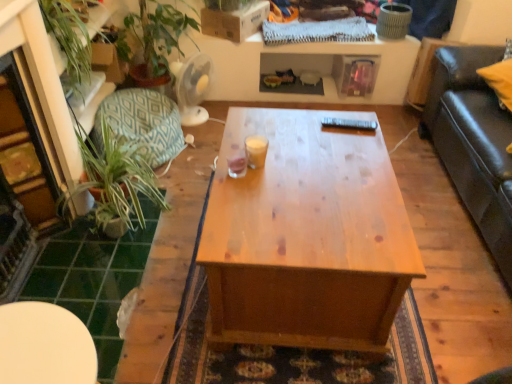
Question: Is point (174, 140) closer or farther from the camera than point (241, 167)?

Choices:
 (A) closer
 (B) farther

Answer: (B)

Question: Would you say teal fabric cushion at left is inside or outside translucent glass at center, which appears as the 1th coffee cup when viewed from the left?

Choices:
 (A) inside
 (B) outside

Answer: (B)

Question: Which object is the closest to the wooden coffee table at center?

Choices:
 (A) green textured plant at lower left
 (B) teal fabric cushion at left
 (C) green tile at lower left
 (D) translucent glass at center, which ranks as the second coffee cup in right-to-left order
 (E) translucent glass cup at center, the 2th coffee cup in the left-to-right sequence

Answer: (E)

Question: Considering the real-world distances, which object is farthest from the teal fabric cushion at left?

Choices:
 (A) white glossy table at lower left
 (B) green tile at lower left
 (C) green textured plant at lower left
 (D) translucent glass at center, which ranks as the second coffee cup in right-to-left order
 (E) wooden coffee table at center

Answer: (A)